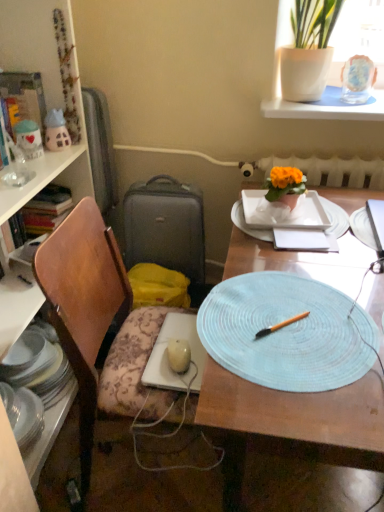
Question: Does light blue woven placemat at center have a greater width compared to white ceramic plate at center, the first plate from the top?

Choices:
 (A) no
 (B) yes

Answer: (B)

Question: Is light blue woven placemat at center bigger than white ceramic plate at center, which is the 2th plate from bottom to top?

Choices:
 (A) yes
 (B) no

Answer: (A)

Question: Does light blue woven placemat at center have a lesser height compared to white ceramic plate at center, the first plate in the right-to-left sequence?

Choices:
 (A) yes
 (B) no

Answer: (B)

Question: From a real-world perspective, is light blue woven placemat at center positioned over white ceramic plate at center, which is the 2th plate from bottom to top, based on gravity?

Choices:
 (A) yes
 (B) no

Answer: (B)

Question: Considering the relative sizes of light blue woven placemat at center and white ceramic plate at center, which is the 2th plate from bottom to top, in the image provided, is light blue woven placemat at center smaller than white ceramic plate at center, which is the 2th plate from bottom to top,?

Choices:
 (A) no
 (B) yes

Answer: (A)

Question: From a real-world perspective, is light blue woven placemat at center above or below matte gray suitcase at left?

Choices:
 (A) below
 (B) above

Answer: (A)

Question: Does point (337, 425) appear closer or farther from the camera than point (200, 245)?

Choices:
 (A) farther
 (B) closer

Answer: (B)

Question: In the image, is light blue woven placemat at center positioned in front of or behind matte gray suitcase at left?

Choices:
 (A) behind
 (B) front

Answer: (B)

Question: Looking at their shapes, would you say light blue woven placemat at center is wider or thinner than matte gray suitcase at left?

Choices:
 (A) wide
 (B) thin

Answer: (A)

Question: From the image's perspective, is wooden chair at left positioned above or below white glossy plate at left, the second plate when ordered from right to left?

Choices:
 (A) below
 (B) above

Answer: (B)

Question: From a real-world perspective, is wooden chair at left positioned above or below white glossy plate at left, arranged as the 2th plate when viewed from the top?

Choices:
 (A) above
 (B) below

Answer: (A)

Question: Is wooden chair at left wider or thinner than white glossy plate at left, which appears as the 1th plate when ordered from the bottom?

Choices:
 (A) thin
 (B) wide

Answer: (B)

Question: Visually, is wooden chair at left positioned to the left or to the right of white glossy plate at left, the 1th plate in the left-to-right sequence?

Choices:
 (A) right
 (B) left

Answer: (A)

Question: Choose the correct answer: Is light blue woven placemat at center inside wooden chair at left or outside it?

Choices:
 (A) outside
 (B) inside

Answer: (A)

Question: From a real-world perspective, is light blue woven placemat at center above or below wooden chair at left?

Choices:
 (A) above
 (B) below

Answer: (B)